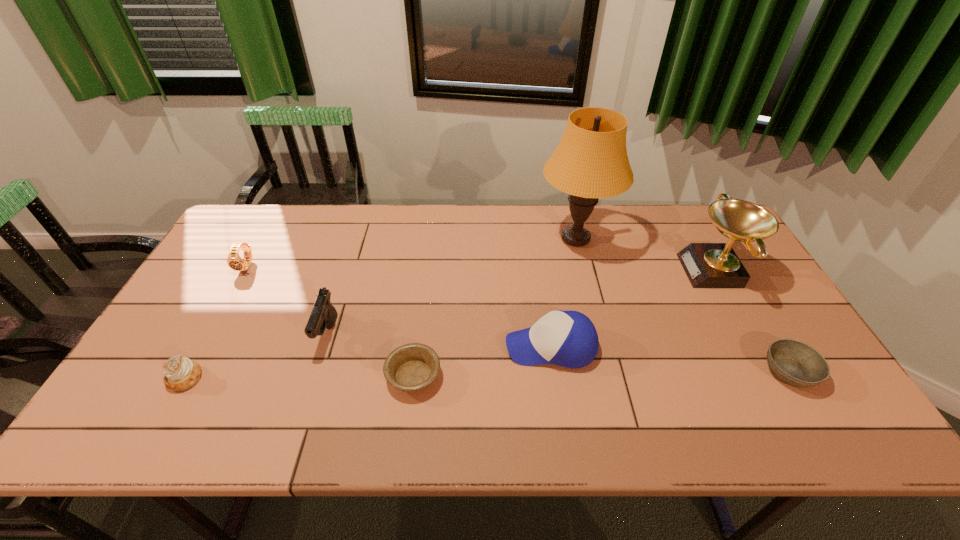
Identify the location of free location located on the right of the fourth object from left to right. (494, 376).

Identify the location of lampshade that is at the far edge. The image size is (960, 540). (590, 162).

The width and height of the screenshot is (960, 540). I want to click on award located at the far edge, so click(x=707, y=265).

Identify the location of watch that is positioned at the left edge. (235, 262).

Where is `pastry at the left edge`? pastry at the left edge is located at coordinates (181, 373).

Find the location of `award present at the right edge`. award present at the right edge is located at coordinates (707, 265).

Image resolution: width=960 pixels, height=540 pixels. I want to click on bowl located in the right edge section of the desktop, so click(x=796, y=363).

You are a GUI agent. You are given a task and a screenshot of the screen. Output one action in this format:
    pyautogui.click(x=<x>, y=<y>)
    Task: Click on the object located in the far right corner section of the desktop
    The height and width of the screenshot is (540, 960).
    Given the screenshot: What is the action you would take?
    pyautogui.click(x=707, y=265)

In the image, there is a desktop. At what (x,y) coordinates should I click in order to perform the action: click on vacant space at the far edge. Please return your answer as a coordinate pair (x, y). This screenshot has height=540, width=960. Looking at the image, I should click on (594, 232).

Locate an element on the screen. The width and height of the screenshot is (960, 540). vacant space at the near edge of the desktop is located at coordinates (228, 439).